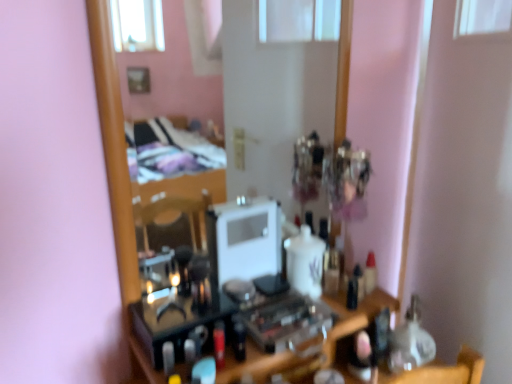
Question: Is translucent plastic bottle at center located outside wooden mirror at center?

Choices:
 (A) yes
 (B) no

Answer: (A)

Question: Considering the relative positions of translucent plastic bottle at center and wooden mirror at center in the image provided, is translucent plastic bottle at center behind wooden mirror at center?

Choices:
 (A) yes
 (B) no

Answer: (A)

Question: From a real-world perspective, is translucent plastic bottle at center below wooden mirror at center?

Choices:
 (A) no
 (B) yes

Answer: (B)

Question: Does translucent plastic bottle at center have a smaller size compared to wooden mirror at center?

Choices:
 (A) no
 (B) yes

Answer: (B)

Question: From a real-world perspective, is translucent plastic bottle at center positioned over wooden mirror at center based on gravity?

Choices:
 (A) no
 (B) yes

Answer: (A)

Question: From the image's perspective, is translucent plastic bottle at center below wooden mirror at center?

Choices:
 (A) yes
 (B) no

Answer: (A)

Question: Is wooden mirror at center further to camera compared to translucent plastic bottle at center?

Choices:
 (A) no
 (B) yes

Answer: (A)

Question: Does wooden mirror at center have a lesser width compared to translucent plastic bottle at center?

Choices:
 (A) yes
 (B) no

Answer: (B)

Question: Are wooden mirror at center and translucent plastic bottle at center beside each other?

Choices:
 (A) no
 (B) yes

Answer: (A)

Question: From a real-world perspective, is wooden mirror at center beneath translucent plastic bottle at center?

Choices:
 (A) no
 (B) yes

Answer: (A)

Question: From the image's perspective, is wooden mirror at center over translucent plastic bottle at center?

Choices:
 (A) no
 (B) yes

Answer: (B)

Question: Can you confirm if wooden mirror at center is positioned to the left of translucent plastic bottle at center?

Choices:
 (A) yes
 (B) no

Answer: (A)

Question: From a real-world perspective, relative to translucent plastic bottle at center, is wooden mirror at center vertically above or below?

Choices:
 (A) below
 (B) above

Answer: (B)